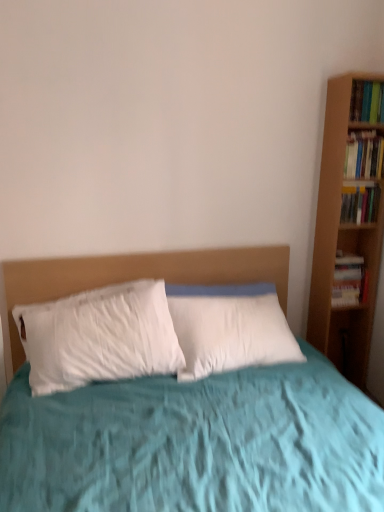
Question: Is hardcover book at right, the third book ordered from the bottom, oriented away from hardcover book at right, which appears as the first book when ordered from the bottom?

Choices:
 (A) no
 (B) yes

Answer: (A)

Question: Is hardcover book at right, arranged as the 2th book when viewed from the top, further to the viewer compared to hardcover book at right, which appears as the first book when ordered from the bottom?

Choices:
 (A) yes
 (B) no

Answer: (B)

Question: Are hardcover book at right, the third book ordered from the bottom, and hardcover book at right, which appears as the first book when ordered from the bottom, beside each other?

Choices:
 (A) yes
 (B) no

Answer: (B)

Question: From the image's perspective, would you say hardcover book at right, the third book ordered from the bottom, is shown under hardcover book at right, arranged as the fourth book when viewed from the top?

Choices:
 (A) yes
 (B) no

Answer: (B)

Question: Considering the relative sizes of hardcover book at right, the third book ordered from the bottom, and hardcover book at right, arranged as the fourth book when viewed from the top, in the image provided, is hardcover book at right, the third book ordered from the bottom, smaller than hardcover book at right, arranged as the fourth book when viewed from the top,?

Choices:
 (A) no
 (B) yes

Answer: (B)

Question: Is hardcover book at right, which appears as the first book when ordered from the bottom, a part of hardcover book at right, the third book ordered from the bottom?

Choices:
 (A) no
 (B) yes

Answer: (A)

Question: Does hardcover book at right, which is the 3th book in top-to-bottom order, appear on the right side of hardcover book at upper right, marked as the first book in a top-to-bottom arrangement?

Choices:
 (A) no
 (B) yes

Answer: (A)

Question: Is hardcover book at right, which is the second book in bottom-to-top order, located outside hardcover book at upper right, placed as the fourth book when sorted from bottom to top?

Choices:
 (A) no
 (B) yes

Answer: (B)

Question: Is hardcover book at right, which is the second book in bottom-to-top order, wider than hardcover book at upper right, marked as the first book in a top-to-bottom arrangement?

Choices:
 (A) yes
 (B) no

Answer: (B)

Question: Is hardcover book at right, which is the 3th book in top-to-bottom order, to the left of hardcover book at upper right, marked as the first book in a top-to-bottom arrangement, from the viewer's perspective?

Choices:
 (A) yes
 (B) no

Answer: (A)

Question: Is the position of hardcover book at right, which is the 3th book in top-to-bottom order, less distant than that of hardcover book at upper right, placed as the fourth book when sorted from bottom to top?

Choices:
 (A) yes
 (B) no

Answer: (B)

Question: From a real-world perspective, is hardcover book at right, which is the 3th book in top-to-bottom order, on top of hardcover book at upper right, marked as the first book in a top-to-bottom arrangement?

Choices:
 (A) no
 (B) yes

Answer: (A)

Question: Is hardcover book at right, arranged as the 2th book when viewed from the top, outside of hardcover book at upper right, placed as the fourth book when sorted from bottom to top?

Choices:
 (A) yes
 (B) no

Answer: (A)